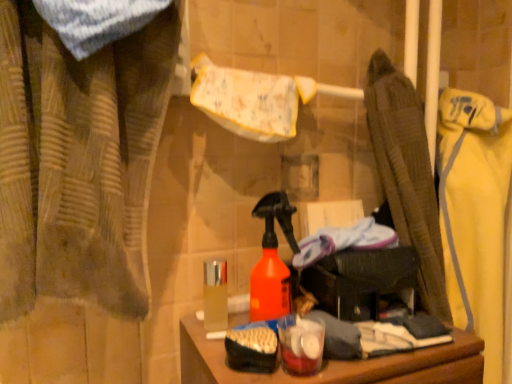
Question: Can you confirm if shiny metallic container at center is thinner than brown textured curtain at left?

Choices:
 (A) yes
 (B) no

Answer: (A)

Question: Is shiny metallic container at center not within brown textured curtain at left?

Choices:
 (A) no
 (B) yes

Answer: (B)

Question: From a real-world perspective, is shiny metallic container at center physically below brown textured curtain at left?

Choices:
 (A) no
 (B) yes

Answer: (B)

Question: Can you confirm if shiny metallic container at center is positioned to the right of brown textured curtain at left?

Choices:
 (A) yes
 (B) no

Answer: (A)

Question: Is brown textured curtain at left at the back of shiny metallic container at center?

Choices:
 (A) no
 (B) yes

Answer: (A)

Question: Visually, is brown textured curtain at left positioned to the left or to the right of shiny metallic container at center?

Choices:
 (A) right
 (B) left

Answer: (B)

Question: Considering the positions of brown textured curtain at left and shiny metallic container at center in the image, is brown textured curtain at left wider or thinner than shiny metallic container at center?

Choices:
 (A) wide
 (B) thin

Answer: (A)

Question: Is point (88, 69) closer or farther from the camera than point (210, 296)?

Choices:
 (A) farther
 (B) closer

Answer: (B)

Question: Is brown textured curtain at left bigger or smaller than shiny metallic container at center?

Choices:
 (A) big
 (B) small

Answer: (A)

Question: Considering the positions of yellow fabric jacket at right and brown textured curtain at left in the image, is yellow fabric jacket at right wider or thinner than brown textured curtain at left?

Choices:
 (A) thin
 (B) wide

Answer: (B)

Question: Is yellow fabric jacket at right taller or shorter than brown textured curtain at left?

Choices:
 (A) short
 (B) tall

Answer: (B)

Question: Relative to brown textured curtain at left, is yellow fabric jacket at right in front or behind?

Choices:
 (A) front
 (B) behind

Answer: (B)

Question: Considering the positions of yellow fabric jacket at right and brown textured curtain at left in the image, is yellow fabric jacket at right bigger or smaller than brown textured curtain at left?

Choices:
 (A) small
 (B) big

Answer: (B)

Question: From the image's perspective, relative to white/yellow fabric towel at upper center, is brown textured curtain at left above or below?

Choices:
 (A) above
 (B) below

Answer: (B)

Question: From a real-world perspective, is brown textured curtain at left physically located above or below white/yellow fabric towel at upper center?

Choices:
 (A) above
 (B) below

Answer: (B)